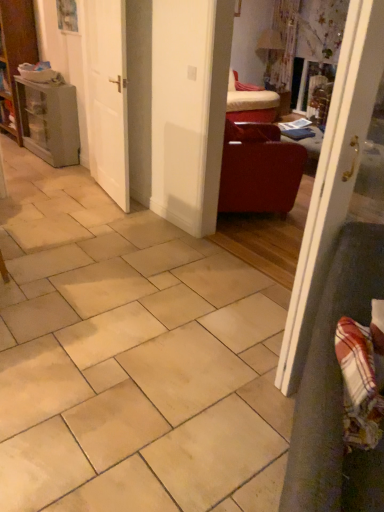
The height and width of the screenshot is (512, 384). I want to click on free space between white matte door at center, the 1th door when ordered from left to right, and white glossy door at right, placed as the 1th door when sorted from right to left, so click(199, 273).